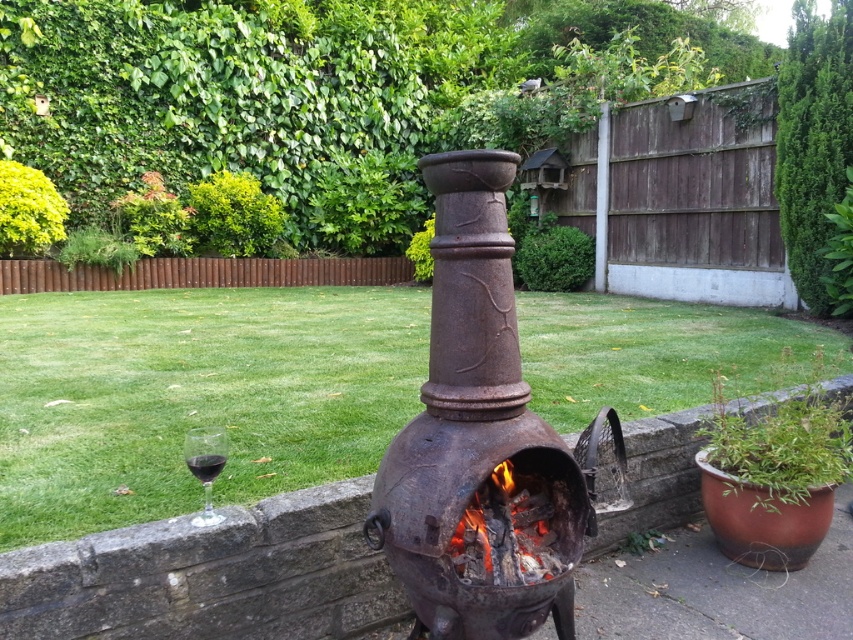
You are standing in the backyard and want to place a new garden statue between the rusty metal chiminea at center and the glass of red wine on the left. Based on their positions, which object should the statue be closer to?

The rusty metal chiminea at center is located at point (194, 396), while the glass of red wine on the left is positioned to the left of the chiminea. Since the statue needs to be placed between them, it should be closer to the glass of red wine on the left as it is farther from the chiminea compared to the wine glass.

You are standing in the backyard and want to place a new decorative item near the fireplace. The coordinates provided in the image are normalized between 0 and 1. If you want to place the item exactly at the point marked by point [480,440], what object will it be placed next to?

The point [480,440] indicates the rusty cast iron fire pit at center, so placing the item there would position it directly next to the rusty cast iron fire pit at center.